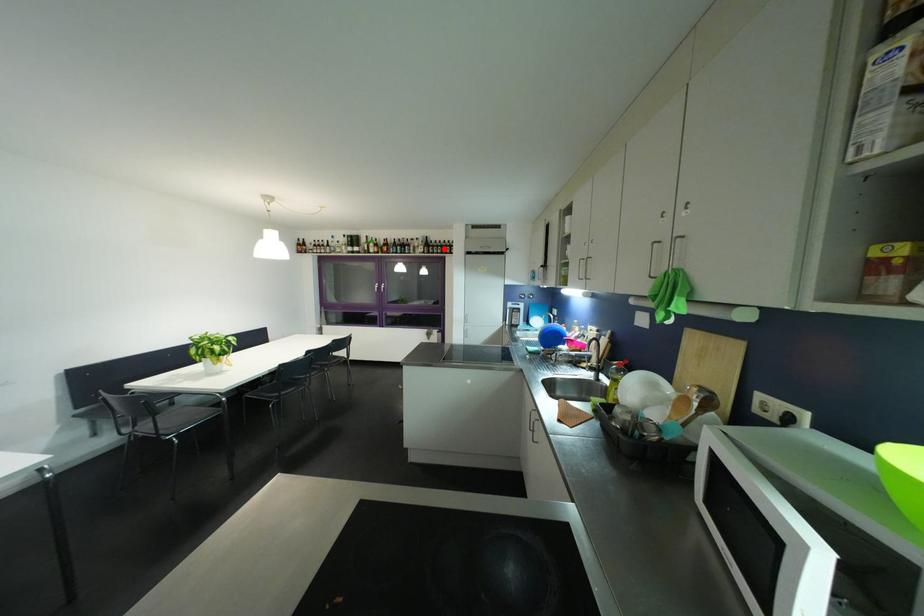
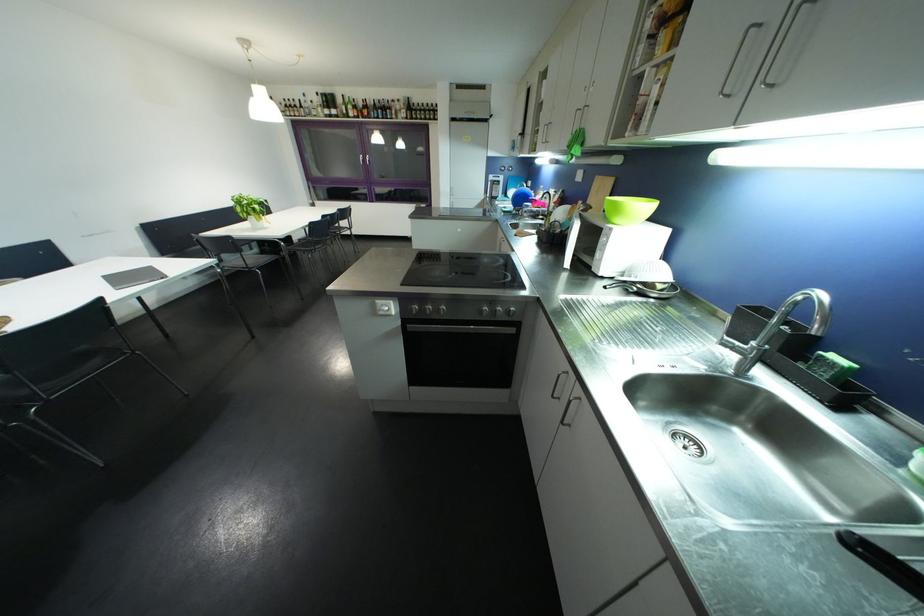
Locate, in the second image, the point that corresponds to the highlighted location in the first image.

(428, 113)